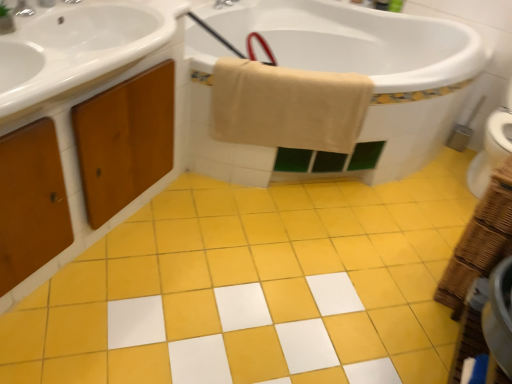
Question: Considering the positions of brushed metal faucet at upper center, which ranks as the second tap in left-to-right order, and brushed metal faucet at upper left, placed as the 2th tap when sorted from top to bottom, in the image, is brushed metal faucet at upper center, which ranks as the second tap in left-to-right order, bigger or smaller than brushed metal faucet at upper left, placed as the 2th tap when sorted from top to bottom,?

Choices:
 (A) small
 (B) big

Answer: (B)

Question: From their relative heights in the image, would you say brushed metal faucet at upper center, acting as the second tap starting from the front, is taller or shorter than brushed metal faucet at upper left, which is counted as the first tap, starting from the front?

Choices:
 (A) tall
 (B) short

Answer: (A)

Question: Which object is the closest to the beige cotton towel at upper center?

Choices:
 (A) brushed metal faucet at upper center, which ranks as the second tap in left-to-right order
 (B) brushed metal faucet at upper left
 (C) wooden cabinet at left
 (D) brushed metal faucet at upper left, arranged as the first tap when ordered from the bottom
 (E) yellow matte tile at center

Answer: (C)

Question: Which is farther from the metallic silver brush at right?

Choices:
 (A) brushed metal faucet at upper left, arranged as the first tap when ordered from the bottom
 (B) white glossy bathtub at upper center
 (C) brushed metal faucet at upper center, placed as the first tap when sorted from top to bottom
 (D) brushed metal faucet at upper left
 (E) beige cotton towel at upper center

Answer: (A)